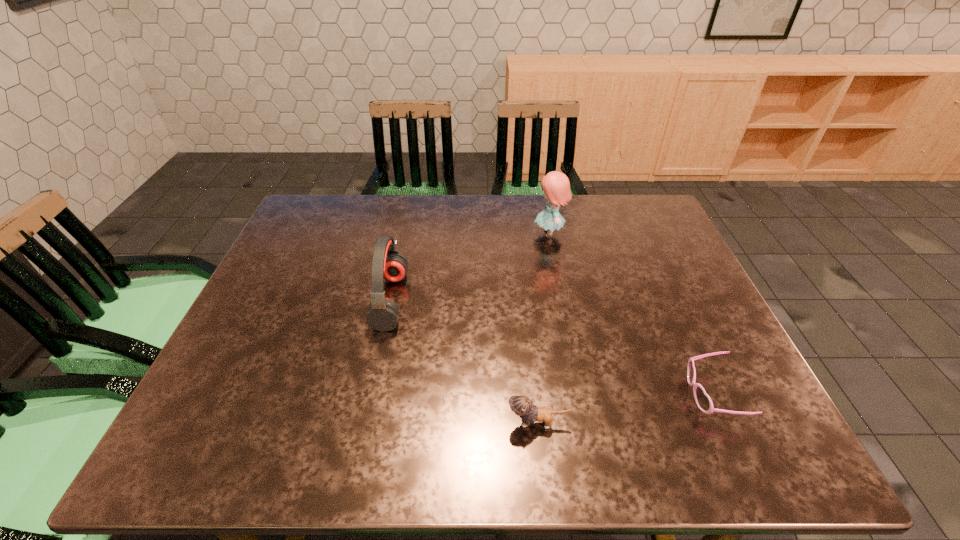
Where is `free space between the sunglasses and the farthest object`? This screenshot has height=540, width=960. free space between the sunglasses and the farthest object is located at coordinates (631, 314).

Identify the location of vacant region between the doll and the kitten. (543, 328).

The width and height of the screenshot is (960, 540). I want to click on free point between the kitten and the second farthest object, so click(464, 362).

At what (x,y) coordinates should I click in order to perform the action: click on free space that is in between the second shortest object and the leftmost object. Please return your answer as a coordinate pair (x, y). Looking at the image, I should click on (464, 362).

Locate an element on the screen. vacant region between the shortest object and the kitten is located at coordinates (625, 409).

This screenshot has height=540, width=960. I want to click on the third closest object to the earphone, so point(703,401).

The width and height of the screenshot is (960, 540). In order to click on object that is the second nearest to the kitten in this screenshot , I will do `click(387, 262)`.